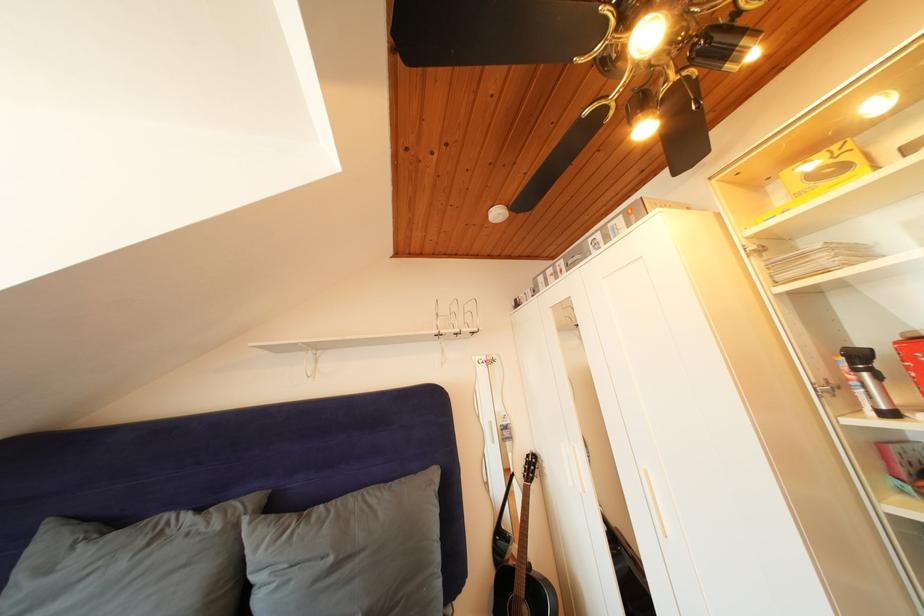
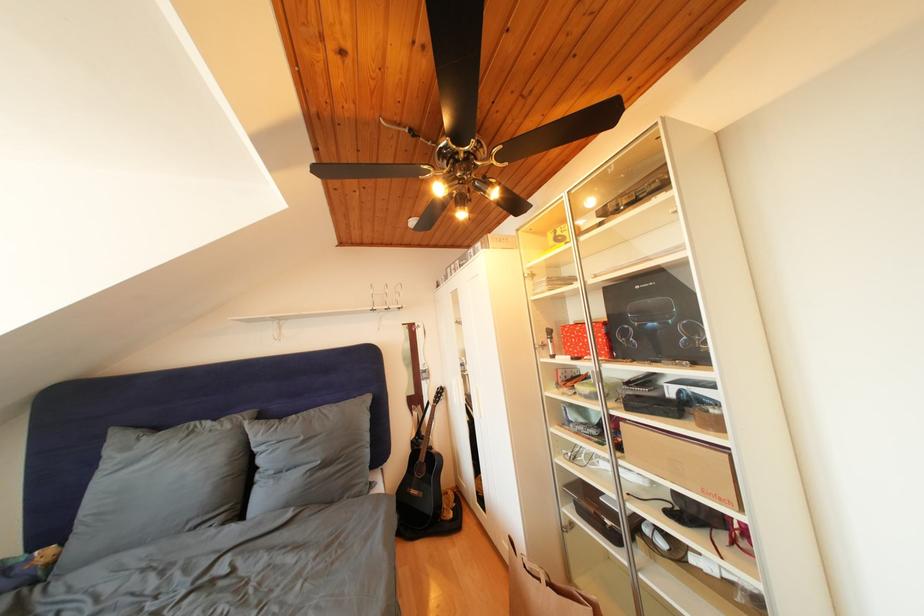
Find the pixel in the second image that matches (x=844, y=392) in the first image.

(552, 351)